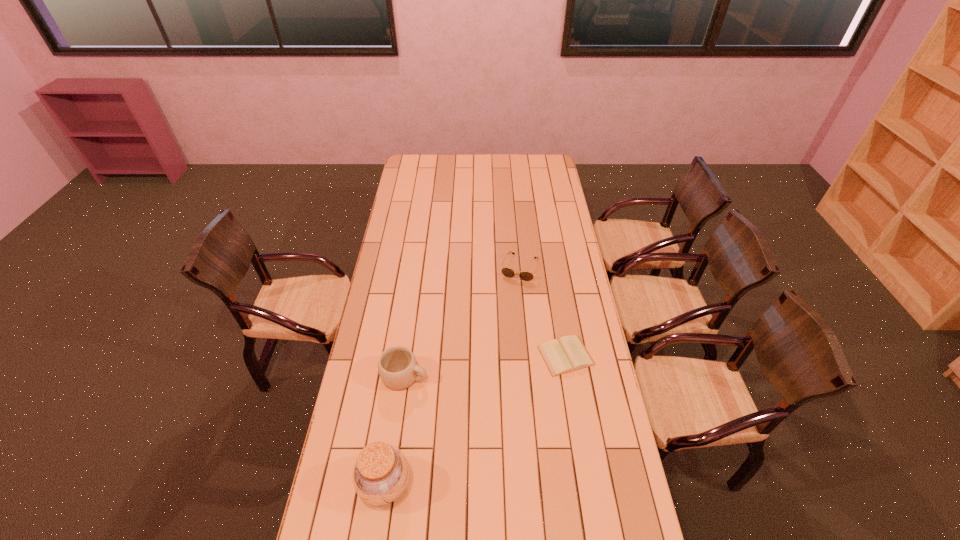
Where is `free region at the near edge of the desktop`? This screenshot has height=540, width=960. free region at the near edge of the desktop is located at coordinates (380, 508).

Where is `free location at the left edge`? The image size is (960, 540). free location at the left edge is located at coordinates (400, 280).

This screenshot has height=540, width=960. Find the location of `vacant region at the right edge of the desktop`. vacant region at the right edge of the desktop is located at coordinates (563, 202).

This screenshot has height=540, width=960. I want to click on blank area at the far left corner, so click(417, 161).

Where is `blank space at the far right corner`? The width and height of the screenshot is (960, 540). blank space at the far right corner is located at coordinates (551, 154).

Identify the location of vacant region between the farthest object and the mug. This screenshot has width=960, height=540. (462, 322).

Where is `free spot between the nearest object and the second tallest object`? The image size is (960, 540). free spot between the nearest object and the second tallest object is located at coordinates (395, 430).

Identify the location of free space between the nearest object and the mug. (395, 430).

The width and height of the screenshot is (960, 540). What are the coordinates of `unoccupied position between the nearest object and the mug` in the screenshot? It's located at (395, 430).

You are a GUI agent. You are given a task and a screenshot of the screen. Output one action in this format:
    pyautogui.click(x=<x>, y=<y>)
    Task: Click on the blank region between the shortest object and the farthest object
    This screenshot has width=960, height=540.
    Given the screenshot: What is the action you would take?
    pyautogui.click(x=542, y=312)